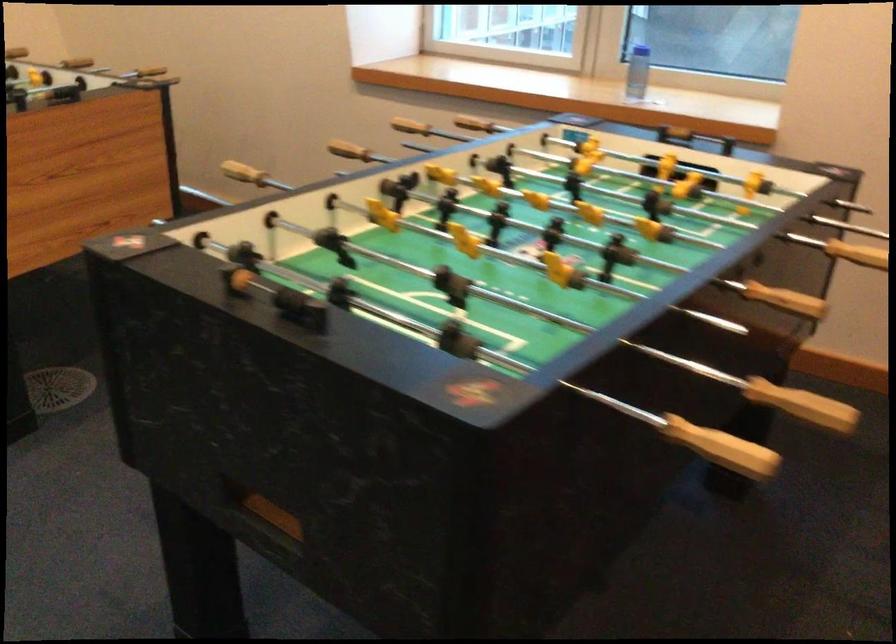
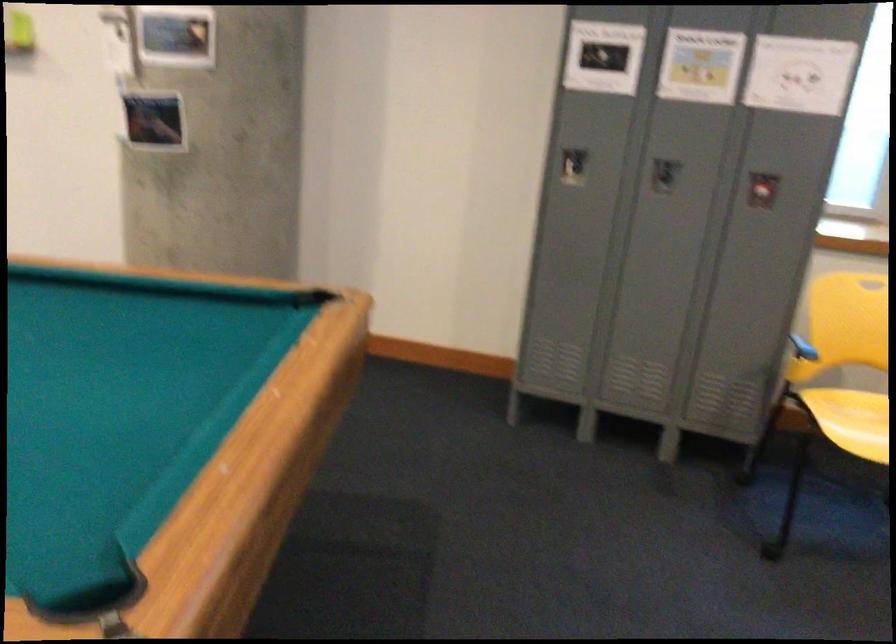
Question: Based on the continuous images, in which direction is the camera rotating? Reply with the corresponding letter.

Choices:
 (A) Left
 (B) Right
 (C) Up
 (D) Down

Answer: (A)